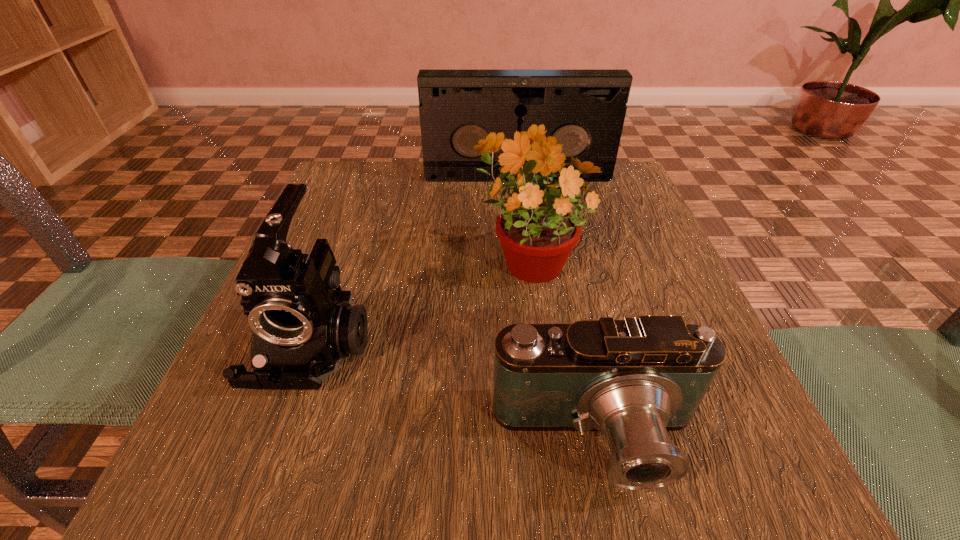
This screenshot has height=540, width=960. In the image, there is a desktop. Identify the location of vacant region at the far left corner. (360, 165).

Find the location of `empty space between the videotape and the leftmost object`. empty space between the videotape and the leftmost object is located at coordinates (416, 260).

The height and width of the screenshot is (540, 960). What are the coordinates of `vacant space that is in between the second farthest object and the left camcorder` in the screenshot? It's located at (420, 301).

This screenshot has width=960, height=540. Find the location of `vacant area that lies between the left camcorder and the shortest object`. vacant area that lies between the left camcorder and the shortest object is located at coordinates (455, 393).

Locate an element on the screen. The height and width of the screenshot is (540, 960). empty space that is in between the videotape and the right camcorder is located at coordinates (558, 309).

Locate an element on the screen. The image size is (960, 540). free point between the videotape and the right camcorder is located at coordinates (558, 309).

In order to click on vacant region between the shortest object and the farthest object in this screenshot , I will do `click(558, 309)`.

The width and height of the screenshot is (960, 540). I want to click on unoccupied area between the left camcorder and the shortest object, so click(455, 393).

Identify the location of empty space that is in between the leftmost object and the flowerpot. (420, 301).

The width and height of the screenshot is (960, 540). Find the location of `free space between the shortest object and the left camcorder`. free space between the shortest object and the left camcorder is located at coordinates (455, 393).